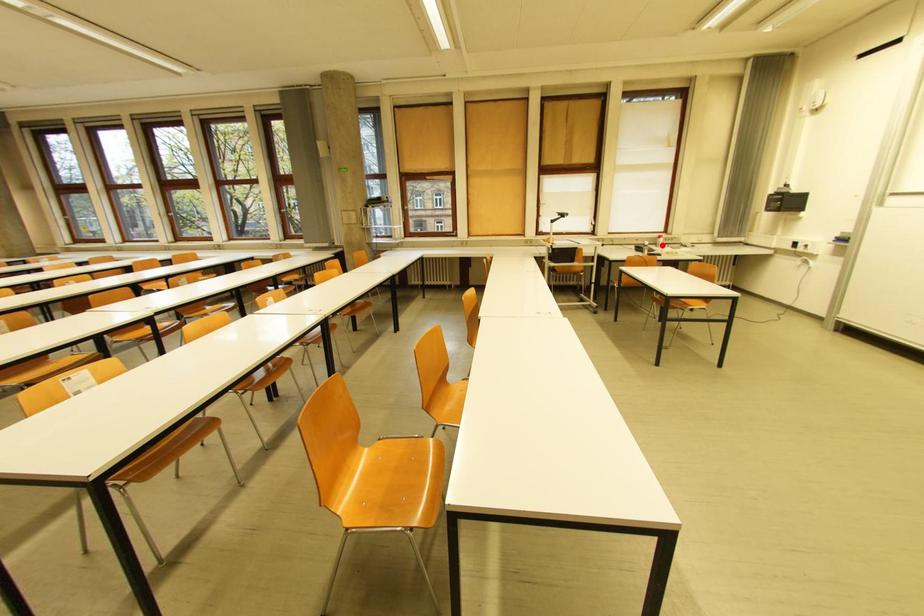
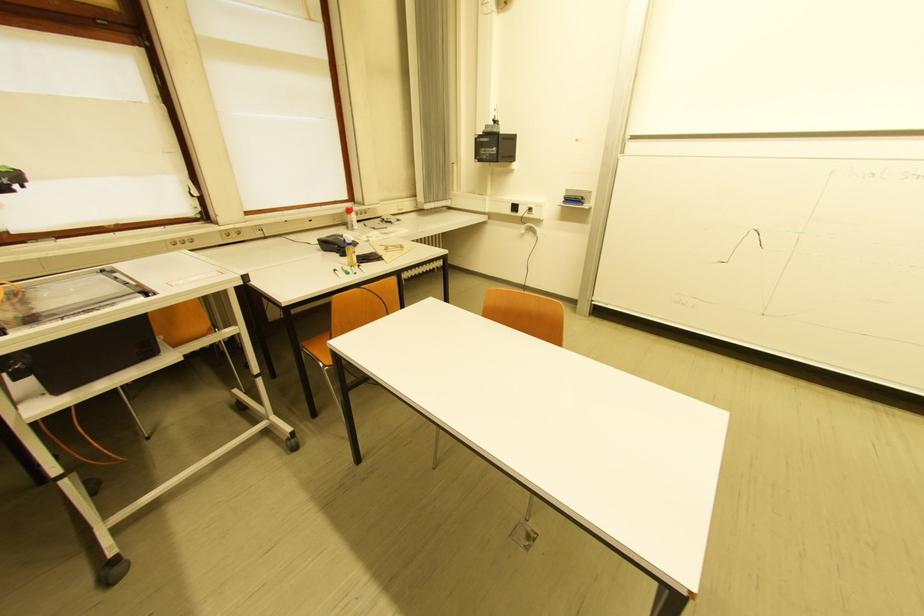
The point at the highlighted location is marked in the first image. Where is the corresponding point in the second image?

(351, 225)